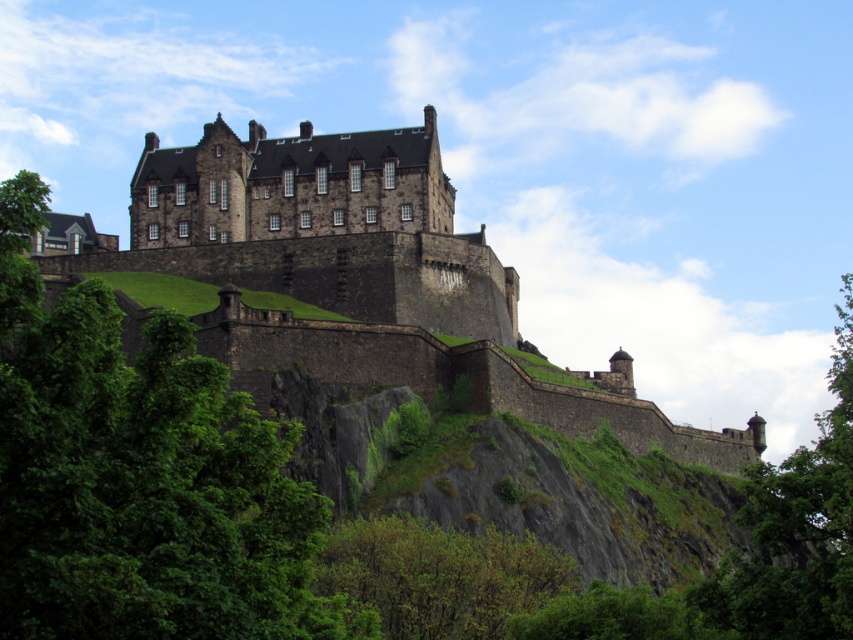
Question: Which point is farther from the camera taking this photo?

Choices:
 (A) (96, 259)
 (B) (714, 444)
 (C) (820, 483)

Answer: (B)

Question: Which object is closer to the camera taking this photo?

Choices:
 (A) dark stone castle at upper center
 (B) dark stone castle at center
 (C) green leafy tree at upper center

Answer: (C)

Question: Does green leafy tree at upper center lie in front of dark stone castle at upper center?

Choices:
 (A) no
 (B) yes

Answer: (B)

Question: Which point is farther to the camera?

Choices:
 (A) green leafy tree at upper center
 (B) dark stone castle at center
 (C) dark stone castle at upper center

Answer: (B)

Question: Can you confirm if dark stone castle at upper center is bigger than green leafy tree at right?

Choices:
 (A) yes
 (B) no

Answer: (B)

Question: Is dark stone castle at upper center to the left of green leafy tree at right from the viewer's perspective?

Choices:
 (A) no
 (B) yes

Answer: (B)